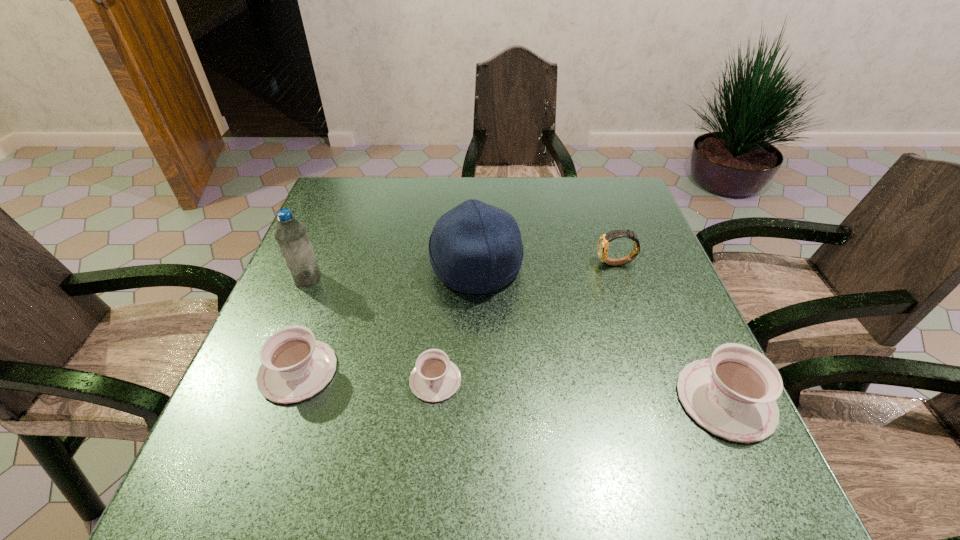
The height and width of the screenshot is (540, 960). In order to click on free space located 0.240m on the handle side of the fifth tallest object in this screenshot , I will do `click(336, 265)`.

Find the location of a particular element. The height and width of the screenshot is (540, 960). free space located 0.070m on the handle side of the shortest object is located at coordinates (430, 440).

Locate an element on the screen. blank space located on the handle side of the rightmost teacup is located at coordinates (699, 341).

Where is `free space located on the handle side of the rightmost teacup`? Image resolution: width=960 pixels, height=540 pixels. free space located on the handle side of the rightmost teacup is located at coordinates (685, 313).

Where is `vacant space located 0.240m on the handle side of the rightmost teacup`? vacant space located 0.240m on the handle side of the rightmost teacup is located at coordinates (670, 279).

This screenshot has height=540, width=960. What are the coordinates of `free point located on the right of the water bottle` in the screenshot? It's located at (363, 279).

I want to click on vacant area situated on the left of the skullcap, so click(x=406, y=267).

You are a GUI agent. You are given a task and a screenshot of the screen. Output one action in this format:
    pyautogui.click(x=<x>, y=<y>)
    Task: Click on the vacant space located on the face of the watch
    The width and height of the screenshot is (960, 540).
    Given the screenshot: What is the action you would take?
    pyautogui.click(x=544, y=264)

Identify the location of free point located 0.220m on the face of the watch. Image resolution: width=960 pixels, height=540 pixels. (509, 264).

Where is `vacant area situated on the face of the watch`? This screenshot has height=540, width=960. vacant area situated on the face of the watch is located at coordinates (472, 264).